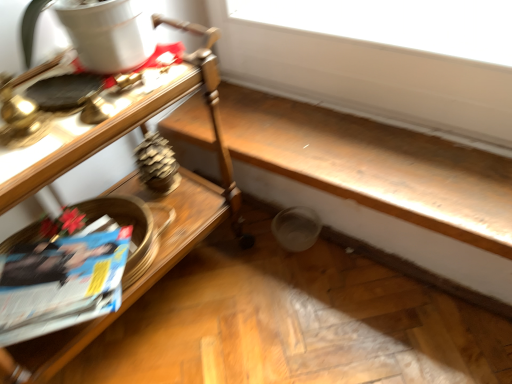
Question: In terms of height, does wooden table at left look taller or shorter compared to blue glossy magazine at lower left?

Choices:
 (A) short
 (B) tall

Answer: (B)

Question: Is wooden table at left to the left or to the right of blue glossy magazine at lower left in the image?

Choices:
 (A) left
 (B) right

Answer: (B)

Question: From the image's perspective, relative to blue glossy magazine at lower left, is wooden table at left above or below?

Choices:
 (A) above
 (B) below

Answer: (A)

Question: Do you think blue glossy magazine at lower left is within wooden table at left, or outside of it?

Choices:
 (A) outside
 (B) inside

Answer: (B)

Question: Relative to wooden table at left, is blue glossy magazine at lower left in front or behind?

Choices:
 (A) front
 (B) behind

Answer: (B)

Question: From a real-world perspective, is blue glossy magazine at lower left positioned above or below wooden table at left?

Choices:
 (A) above
 (B) below

Answer: (B)

Question: Visually, is blue glossy magazine at lower left positioned to the left or to the right of wooden table at left?

Choices:
 (A) left
 (B) right

Answer: (A)